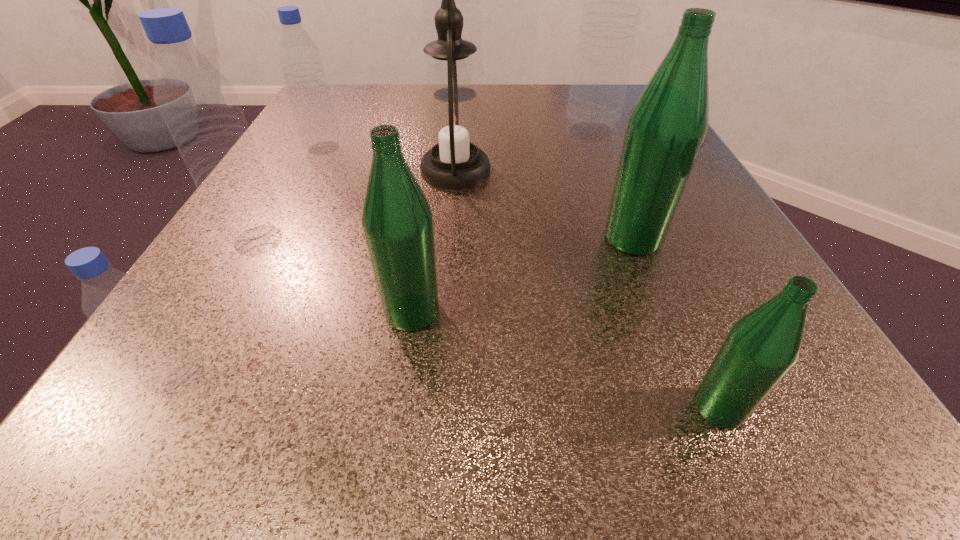
In order to click on the nearest blue bottle in this screenshot , I will do pyautogui.click(x=124, y=310).

I want to click on the smallest green bottle, so click(x=762, y=346).

Where is `free region located 0.120m on the left of the farthest blue bottle`? The image size is (960, 540). free region located 0.120m on the left of the farthest blue bottle is located at coordinates (376, 94).

Find the location of a particular element. free space located 0.230m on the left of the rightmost blue bottle is located at coordinates (452, 130).

Locate an element on the screen. free space located on the right of the oil lamp is located at coordinates (612, 171).

I want to click on free space located 0.120m on the front of the third biggest blue bottle, so click(208, 328).

Locate an element on the screen. vacant space located on the back of the farthest green bottle is located at coordinates (615, 194).

The width and height of the screenshot is (960, 540). What are the coordinates of `free spot located 0.230m on the front of the fourth biggest blue bottle` in the screenshot? It's located at 278,234.

Locate an element on the screen. Image resolution: width=960 pixels, height=540 pixels. vacant space situated 0.230m on the left of the leftmost green bottle is located at coordinates (199, 312).

Where is `free space located 0.120m on the right of the nearest blue bottle`? This screenshot has height=540, width=960. free space located 0.120m on the right of the nearest blue bottle is located at coordinates (317, 381).